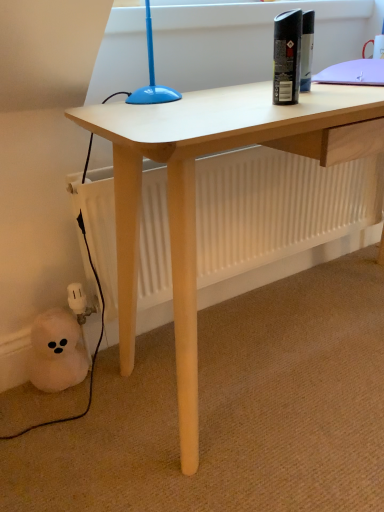
You are a GUI agent. You are given a task and a screenshot of the screen. Output one action in this format:
    pyautogui.click(x=<x>, y=<y>)
    Task: Click on the free space on the front side of black rubber cable at lower left
    
    Given the screenshot: What is the action you would take?
    pyautogui.click(x=63, y=426)